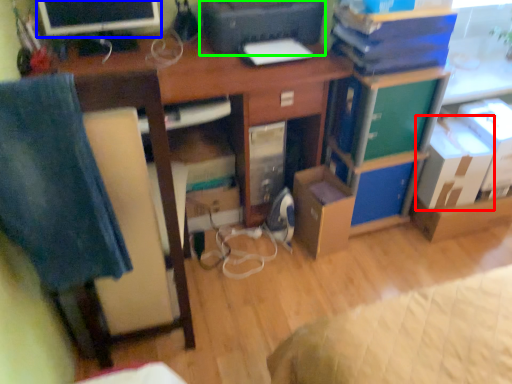
Question: Which is farther away from cardboard box (highlighted by a red box)? computer monitor (highlighted by a blue box) or printer (highlighted by a green box)?

Choices:
 (A) computer monitor
 (B) printer

Answer: (A)